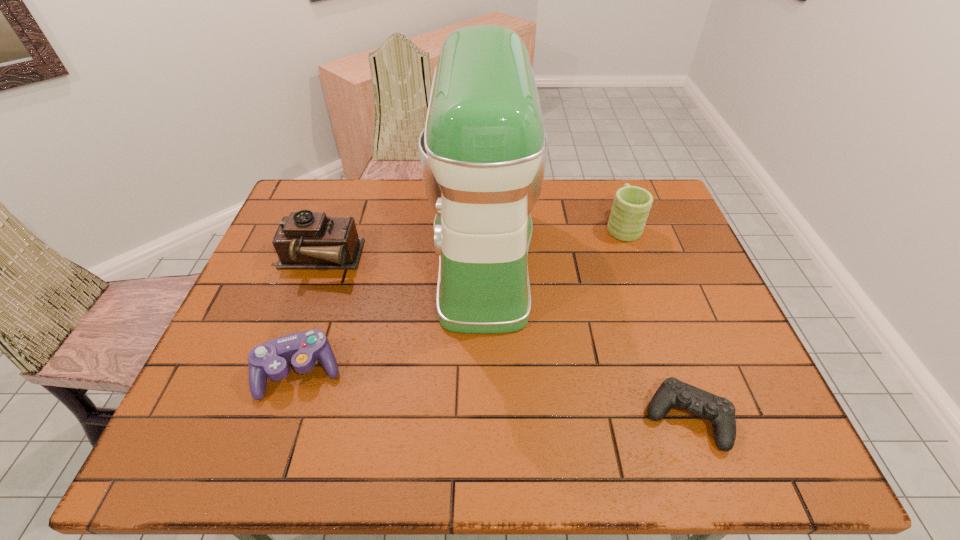
This screenshot has height=540, width=960. In order to click on vacant area between the taller control and the tallest object in this screenshot , I will do `click(392, 315)`.

Where is `free space between the right control and the third object from left to right`? free space between the right control and the third object from left to right is located at coordinates (585, 338).

What are the coordinates of `blank region between the phonograph_record and the tallest object` in the screenshot? It's located at (400, 259).

Locate an element on the screen. free space between the mixer and the shortest object is located at coordinates (585, 338).

Where is `free point between the left control and the phonograph_record`? The height and width of the screenshot is (540, 960). free point between the left control and the phonograph_record is located at coordinates (308, 316).

This screenshot has height=540, width=960. Find the location of `vacant area that lies between the third object from left to right and the right control`. vacant area that lies between the third object from left to right and the right control is located at coordinates (585, 338).

Find the location of a particular element. the fourth closest object to the shortest object is located at coordinates (304, 240).

Select which object appears as the second closest to the mug. Please provide its 2D coordinates. Your answer should be formatted as a tuple, i.e. [(x, y)], where the tuple contains the x and y coordinates of a point satisfying the conditions above.

[(672, 392)]

Locate an element on the screen. The width and height of the screenshot is (960, 540). blank area in the image that satisfies the following two spatial constraints: 1. on the controls of the third object from left to right; 2. on the back side of the right control is located at coordinates (484, 418).

At what (x,y) coordinates should I click in order to perform the action: click on free space that satisfies the following two spatial constraints: 1. on the back side of the shortest object; 2. on the horn of the phonograph_record. Please return your answer as a coordinate pair (x, y). The image size is (960, 540). Looking at the image, I should click on (632, 260).